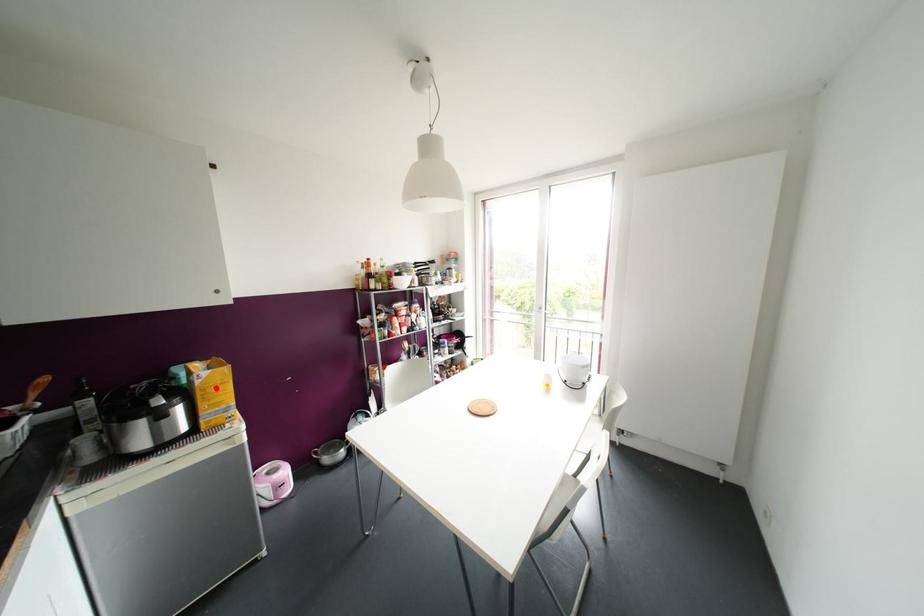
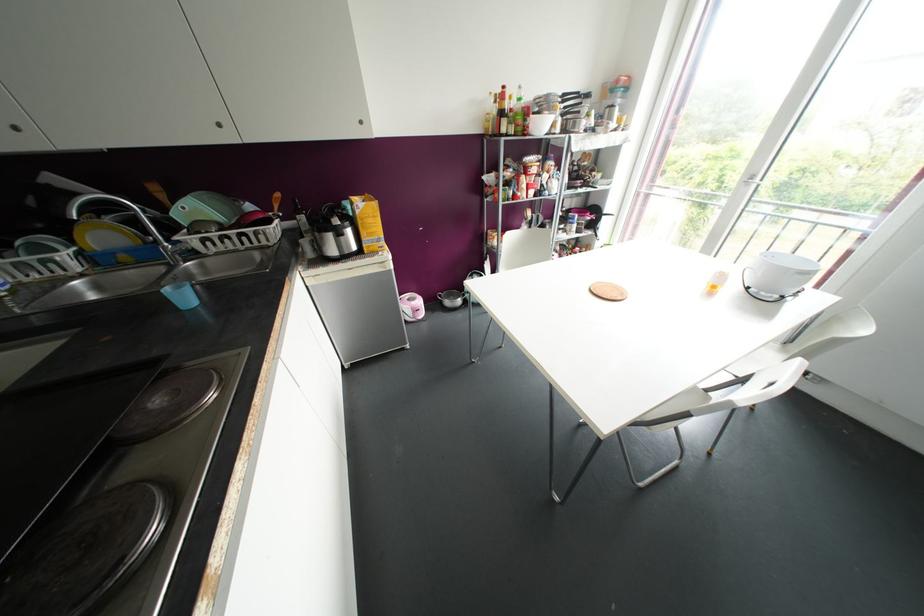
Where in the second image is the point corresponding to the highlighted location from the first image?

(370, 220)